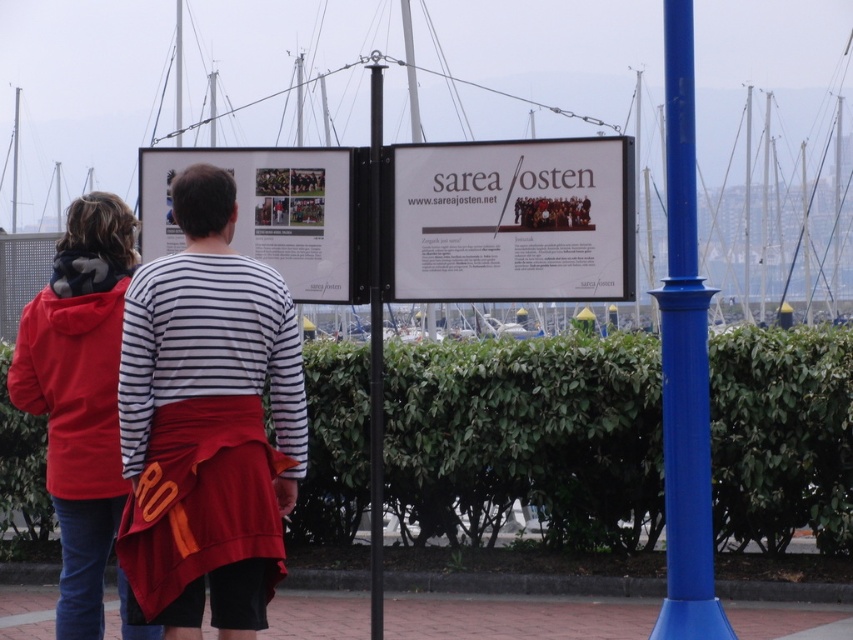
Can you confirm if matte striped shirt at center is positioned to the left of white paper signage at center?

Yes, matte striped shirt at center is to the left of white paper signage at center.

Who is more distant from viewer, (180, 632) or (573, 216)?

Positioned behind is point (573, 216).

Where is `matte striped shirt at center`? matte striped shirt at center is located at coordinates (207, 422).

Does green leafy hedge at center come in front of white paper signage at center?

No, green leafy hedge at center is behind white paper signage at center.

Does green leafy hedge at center have a lesser height compared to white paper signage at center?

Incorrect, green leafy hedge at center's height does not fall short of white paper signage at center's.

This screenshot has height=640, width=853. What are the coordinates of `green leafy hedge at center` in the screenshot? It's located at (527, 436).

Which is below, white paper signage at center or blue glossy pole at right?

blue glossy pole at right

Between point (505, 275) and point (688, 90), which one is positioned in front?

Point (688, 90) is in front.

Find the location of `white paper signage at center`. white paper signage at center is located at coordinates (511, 220).